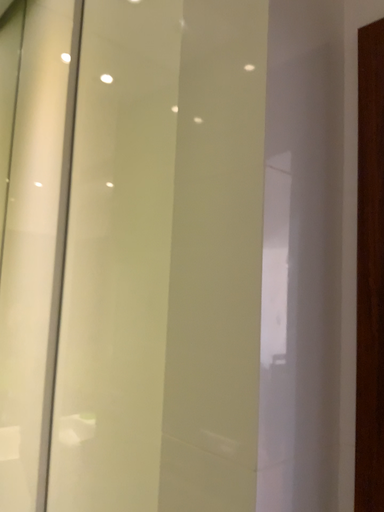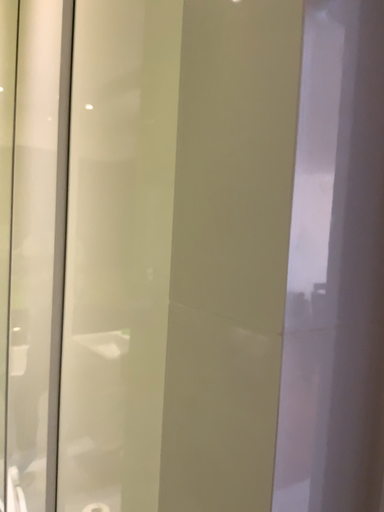
Question: How did the camera likely rotate when shooting the video?

Choices:
 (A) rotated downward
 (B) rotated upward

Answer: (A)